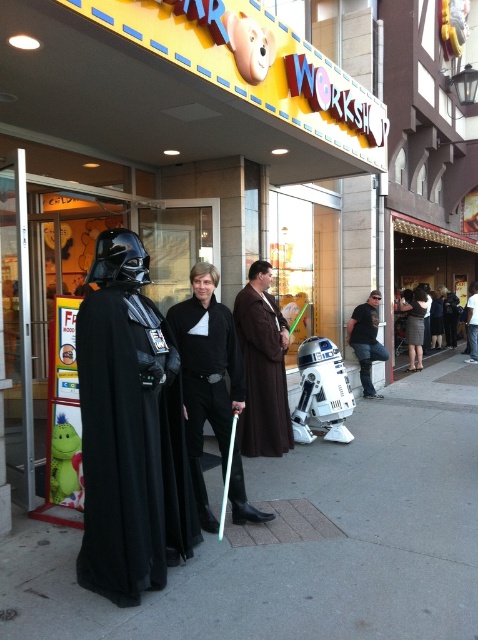
Find the location of a particular element. This screenshot has width=478, height=640. brown matte robe at center is located at coordinates (262, 368).

Who is more distant from viewer, [271,317] or [422,339]?

Point [422,339]

Which is in front, point (239, 312) or point (420, 369)?

Positioned in front is point (239, 312).

The height and width of the screenshot is (640, 478). I want to click on brown matte robe at center, so click(262, 368).

Who is more forward, (119, 397) or (217, 422)?

Point (119, 397)

Does black matte cloak at left have a greater width compared to black matte/light saber at center?

In fact, black matte cloak at left might be narrower than black matte/light saber at center.

The width and height of the screenshot is (478, 640). Identify the location of black matte cloak at left. (130, 449).

Does black matte/light saber at center appear under brown matte robe at center?

Indeed, black matte/light saber at center is positioned under brown matte robe at center.

Does black matte/light saber at center have a smaller size compared to brown matte robe at center?

No, black matte/light saber at center is not smaller than brown matte robe at center.

Locate an element on the screen. This screenshot has height=640, width=478. black matte/light saber at center is located at coordinates (206, 374).